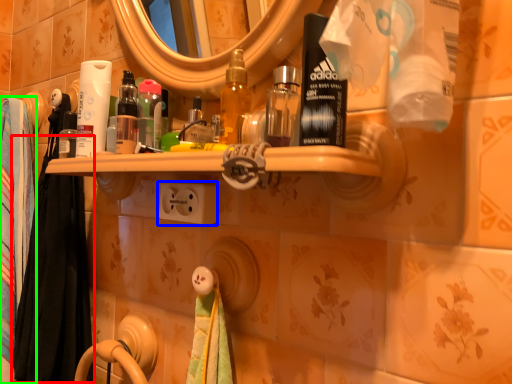
Question: Considering the real-world distances, which object is closest to bath towel (highlighted by a red box)? electric outlet (highlighted by a blue box) or bath towel (highlighted by a green box).

Choices:
 (A) electric outlet
 (B) bath towel

Answer: (B)